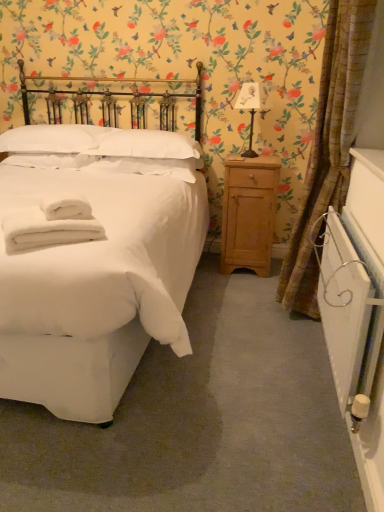
The width and height of the screenshot is (384, 512). What do you see at coordinates (328, 148) in the screenshot?
I see `textured beige curtain at right` at bounding box center [328, 148].

At what (x,y) coordinates should I click in order to perform the action: click on textured beige curtain at right. Please return your answer as a coordinate pair (x, y). The width and height of the screenshot is (384, 512). Looking at the image, I should click on (328, 148).

The image size is (384, 512). Identify the location of light wood/roughnightstand at right. (249, 213).

Locate an element on the screen. This screenshot has height=512, width=384. white soft towel at lower left is located at coordinates (52, 223).

At what (x,y) coordinates should I click in order to perform the action: click on white cotton bed at left. Please return your answer as a coordinate pair (x, y). The image size is (384, 512). Looking at the image, I should click on (97, 279).

Image resolution: width=384 pixels, height=512 pixels. What are the coordinates of `white soft pillow at upper left, the second pillow when ordered from right to left` in the screenshot? It's located at (54, 138).

Describe the element at coordinates (54, 138) in the screenshot. I see `white soft pillow at upper left, the second pillow when ordered from right to left` at that location.

What is the approximate height of white paper lampshade at upper right?

The height of white paper lampshade at upper right is 18.19 inches.

Identify the location of white soft pillow at upper center, which is the second pillow in left-to-right order. (140, 143).

Is textured beige curtain at right a part of light wood/roughnightstand at right?

That's incorrect, textured beige curtain at right is not inside light wood/roughnightstand at right.

Is light wood/roughnightstand at right touching textured beige curtain at right?

They are not placed beside each other.

From the image's perspective, is light wood/roughnightstand at right above textured beige curtain at right?

No, from the image's perspective, light wood/roughnightstand at right is not above textured beige curtain at right.

Considering the sizes of light wood/roughnightstand at right and textured beige curtain at right in the image, is light wood/roughnightstand at right taller or shorter than textured beige curtain at right?

Considering their sizes, light wood/roughnightstand at right has less height than textured beige curtain at right.

Who is more distant, white cotton bed at left or white soft pillow at upper center, the 1th pillow positioned from the right?

white soft pillow at upper center, the 1th pillow positioned from the right.

From a real-world perspective, is white cotton bed at left physically above white soft pillow at upper center, the 1th pillow positioned from the right?

No.

From the image's perspective, which one is positioned lower, white cotton bed at left or white soft pillow at upper center, which is the second pillow in left-to-right order?

white cotton bed at left is shown below in the image.

Between white cotton bed at left and white soft pillow at upper center, which is the second pillow in left-to-right order, which one has more height?

Standing taller between the two is white cotton bed at left.

Which object is wider, white soft towel at lower left or white soft pillow at upper left, marked as the first pillow in a left-to-right arrangement?

With larger width is white soft pillow at upper left, marked as the first pillow in a left-to-right arrangement.

How many degrees apart are the facing directions of white soft towel at lower left and white soft pillow at upper left, the second pillow when ordered from right to left?

There is a 35.9-degree angle between the facing directions of white soft towel at lower left and white soft pillow at upper left, the second pillow when ordered from right to left.

Does white soft towel at lower left touch white soft pillow at upper left, the second pillow when ordered from right to left?

white soft towel at lower left and white soft pillow at upper left, the second pillow when ordered from right to left, are not in contact.

From the image's perspective, which is below, white soft towel at lower left or white soft pillow at upper left, the second pillow when ordered from right to left?

white soft towel at lower left appears lower in the image.

Find the location of a particular element. The image size is (384, 512). the 1st pillow counting from the left of the textured beige curtain at right is located at coordinates (140, 143).

Does textured beige curtain at right have a lesser height compared to white soft pillow at upper center, the 1th pillow positioned from the right?

No, textured beige curtain at right is not shorter than white soft pillow at upper center, the 1th pillow positioned from the right.

Considering the sizes of objects textured beige curtain at right and white soft pillow at upper center, the 1th pillow positioned from the right, in the image provided, who is wider, textured beige curtain at right or white soft pillow at upper center, the 1th pillow positioned from the right,?

white soft pillow at upper center, the 1th pillow positioned from the right.

The image size is (384, 512). I want to click on the 2nd pillow behind the white cotton bed at left, starting your count from the anchor, so click(x=54, y=138).

How distant is white cotton bed at left from white soft pillow at upper left, the second pillow when ordered from right to left?

The distance of white cotton bed at left from white soft pillow at upper left, the second pillow when ordered from right to left, is 28.17 inches.

Who is shorter, white cotton bed at left or white soft pillow at upper left, the second pillow when ordered from right to left?

white soft pillow at upper left, the second pillow when ordered from right to left, is shorter.

Based on the photo, which is less distant, [147,289] or [48,140]?

The point [147,289] is in front.

From the picture: Does textured beige curtain at right have a greater width compared to white cotton bed at left?

Incorrect, the width of textured beige curtain at right does not surpass that of white cotton bed at left.

The height and width of the screenshot is (512, 384). I want to click on bed to the left of textured beige curtain at right, so [97, 279].

Between textured beige curtain at right and white cotton bed at left, which one has more height?

With more height is textured beige curtain at right.

What's the angular difference between textured beige curtain at right and white soft pillow at upper left, the second pillow when ordered from right to left,'s facing directions?

There is a 87.7-degree angle between the facing directions of textured beige curtain at right and white soft pillow at upper left, the second pillow when ordered from right to left.

Considering the sizes of objects textured beige curtain at right and white soft pillow at upper left, the second pillow when ordered from right to left, in the image provided, who is shorter, textured beige curtain at right or white soft pillow at upper left, the second pillow when ordered from right to left,?

white soft pillow at upper left, the second pillow when ordered from right to left.

Is white soft pillow at upper left, the second pillow when ordered from right to left, surrounded by textured beige curtain at right?

That's incorrect, white soft pillow at upper left, the second pillow when ordered from right to left, is not inside textured beige curtain at right.

There is a textured beige curtain at right. Identify the location of the 2nd pillow above it (from the image's perspective). (54, 138).

You are a GUI agent. You are given a task and a screenshot of the screen. Output one action in this format:
    pyautogui.click(x=<x>, y=<y>)
    Task: Click on the curtain that appears on the right of light wood/roughnightstand at right
    This screenshot has width=384, height=512.
    Given the screenshot: What is the action you would take?
    pyautogui.click(x=328, y=148)

Where is `bed in front of the white soft pillow at upper center, the 1th pillow positioned from the right`? The image size is (384, 512). bed in front of the white soft pillow at upper center, the 1th pillow positioned from the right is located at coordinates (97, 279).

From the image, which object appears to be farther from white cotton bed at left, white soft towel at lower left or white soft pillow at upper center, which is the second pillow in left-to-right order?

white soft pillow at upper center, which is the second pillow in left-to-right order, is positioned further to the anchor white cotton bed at left.

Estimate the real-world distances between objects in this image. Which object is further from white soft pillow at upper left, marked as the first pillow in a left-to-right arrangement, textured beige curtain at right or white soft towel at lower left?

The object further to white soft pillow at upper left, marked as the first pillow in a left-to-right arrangement, is textured beige curtain at right.

Based on their spatial positions, is textured beige curtain at right or light wood/roughnightstand at right further from white soft pillow at upper center, the 1th pillow positioned from the right?

Among the two, textured beige curtain at right is located further to white soft pillow at upper center, the 1th pillow positioned from the right.

When comparing their distances from white cotton bed at left, does white soft towel at lower left or white paper lampshade at upper right seem further?

The object further to white cotton bed at left is white paper lampshade at upper right.

Looking at the image, which one is located closer to white soft towel at lower left, white cotton bed at left or white paper lampshade at upper right?

The object closer to white soft towel at lower left is white cotton bed at left.

Which object lies further to the anchor point white soft pillow at upper center, which is the second pillow in left-to-right order, white soft pillow at upper left, marked as the first pillow in a left-to-right arrangement, or white soft towel at lower left?

white soft towel at lower left lies further to white soft pillow at upper center, which is the second pillow in left-to-right order, than the other object.

Which object lies further to the anchor point white soft pillow at upper left, the second pillow when ordered from right to left, light wood/roughnightstand at right or white cotton bed at left?

light wood/roughnightstand at right is further to white soft pillow at upper left, the second pillow when ordered from right to left.

In the scene shown: Which object lies further to the anchor point white soft pillow at upper left, the second pillow when ordered from right to left, white soft towel at lower left or textured beige curtain at right?

textured beige curtain at right is further to white soft pillow at upper left, the second pillow when ordered from right to left.

Where is `pillow between white soft towel at lower left and white soft pillow at upper left, the second pillow when ordered from right to left, along the z-axis`? pillow between white soft towel at lower left and white soft pillow at upper left, the second pillow when ordered from right to left, along the z-axis is located at coordinates (140, 143).

Locate an element on the screen. The image size is (384, 512). pillow between textured beige curtain at right and white paper lampshade at upper right in the front-back direction is located at coordinates (140, 143).

The width and height of the screenshot is (384, 512). I want to click on nightstand between white cotton bed at left and white soft pillow at upper left, marked as the first pillow in a left-to-right arrangement, in the front-back direction, so click(249, 213).

Where is `bath towel located between white cotton bed at left and white soft pillow at upper center, the 1th pillow positioned from the right, in the depth direction`? The height and width of the screenshot is (512, 384). bath towel located between white cotton bed at left and white soft pillow at upper center, the 1th pillow positioned from the right, in the depth direction is located at coordinates (52, 223).